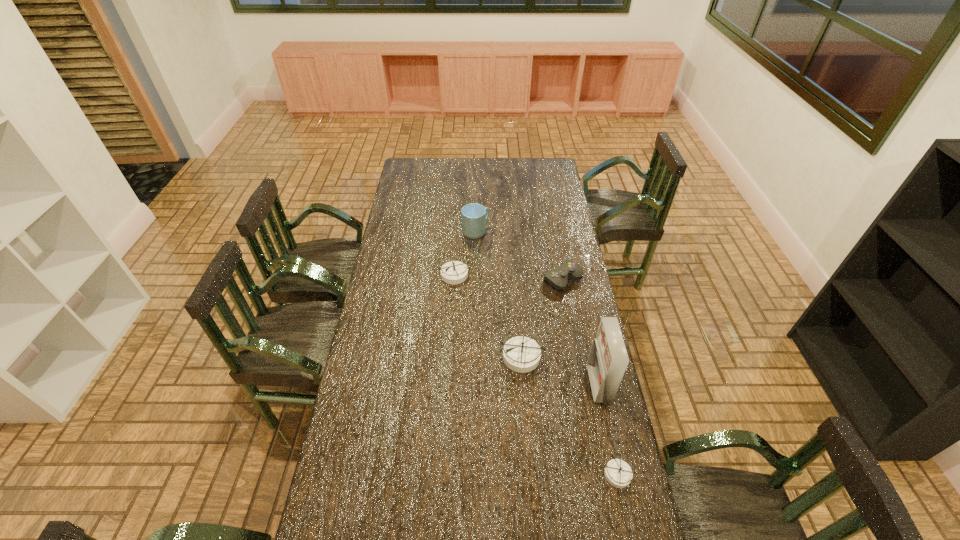
Locate an element on the screen. Image resolution: width=960 pixels, height=540 pixels. the leftmost compass is located at coordinates (454, 272).

Image resolution: width=960 pixels, height=540 pixels. I want to click on the farthest compass, so click(454, 272).

Identify the location of the third object from left to right. The image size is (960, 540). (521, 354).

Find the location of a particular element. The width and height of the screenshot is (960, 540). the second nearest compass is located at coordinates (521, 354).

This screenshot has width=960, height=540. Identify the location of the nearest object. (618, 473).

Identify the location of the nearest compass. (618, 473).

The height and width of the screenshot is (540, 960). Find the location of `the fifth shortest object`. the fifth shortest object is located at coordinates (473, 215).

You are a GUI agent. You are given a task and a screenshot of the screen. Output one action in this format:
    pyautogui.click(x=<x>, y=<y>)
    Task: Click on the farthest object
    This screenshot has height=540, width=960.
    Given the screenshot: What is the action you would take?
    pyautogui.click(x=473, y=215)

The image size is (960, 540). What are the coordinates of `control` in the screenshot? It's located at (558, 278).

Locate an element on the screen. The height and width of the screenshot is (540, 960). the tallest object is located at coordinates click(608, 359).